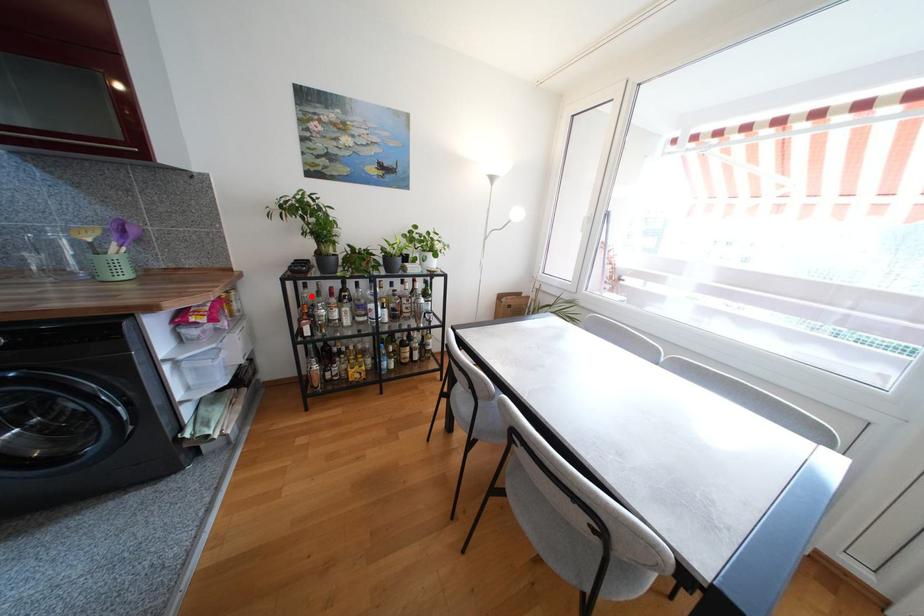
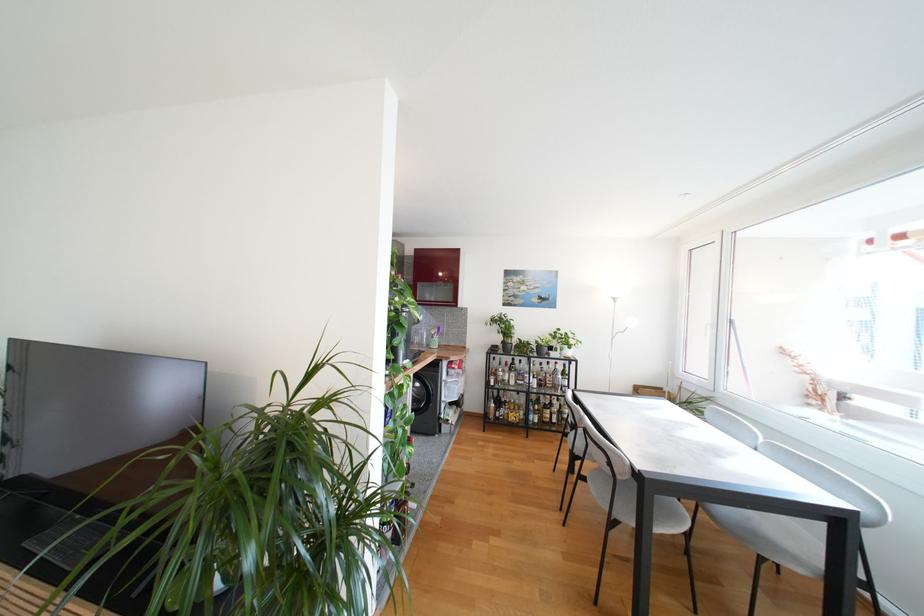
Question: A red point is marked in image1. In image2, is the corresponding 3D point closer to the camera or farther? Reply with the corresponding letter.

Choices:
 (A) The corresponding 3D point is closer.
 (B) The corresponding 3D point is farther.

Answer: (B)